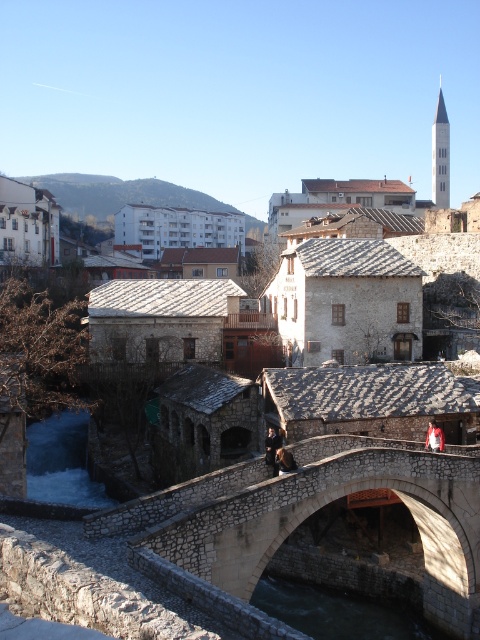
Does green stone water at lower center have a larger size compared to red leather jacket at center?

Correct, green stone water at lower center is larger in size than red leather jacket at center.

Who is positioned more to the right, green stone water at lower center or red leather jacket at center?

red leather jacket at center

Is point (323, 625) positioned after point (431, 440)?

Yes.

This screenshot has width=480, height=640. In order to click on green stone water at lower center in this screenshot , I will do `click(340, 611)`.

Is green stone water at lower center wider than white frothy water at lower left?

No.

Does green stone water at lower center appear on the right side of white frothy water at lower left?

Correct, you'll find green stone water at lower center to the right of white frothy water at lower left.

What do you see at coordinates (340, 611) in the screenshot?
I see `green stone water at lower center` at bounding box center [340, 611].

The image size is (480, 640). In order to click on green stone water at lower center in this screenshot , I will do `click(340, 611)`.

Who is shorter, stone textured bridge at center or red leather jacket at center?

Standing shorter between the two is red leather jacket at center.

Is stone textured bridge at center thinner than red leather jacket at center?

In fact, stone textured bridge at center might be wider than red leather jacket at center.

Where is `stone textured bridge at center`? This screenshot has width=480, height=640. stone textured bridge at center is located at coordinates (301, 522).